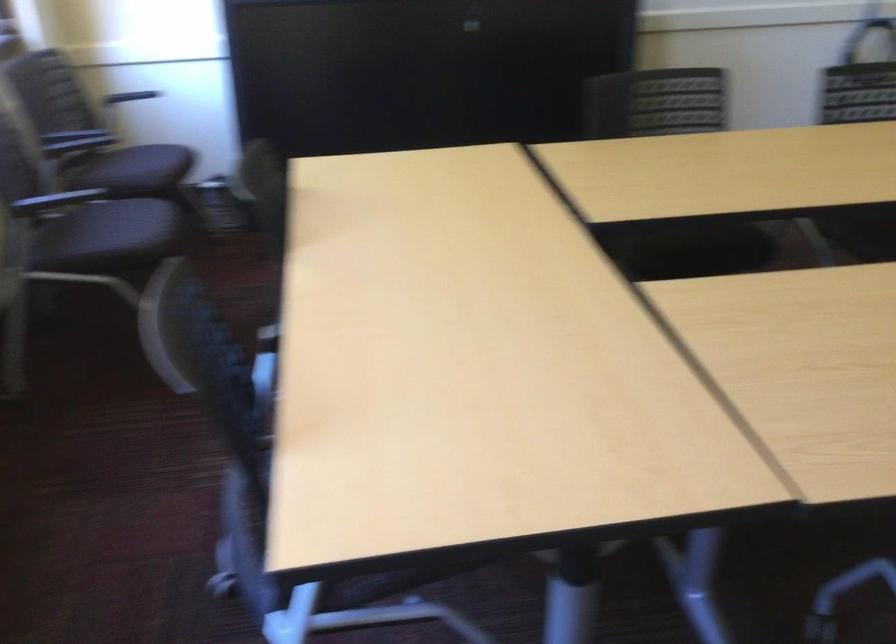
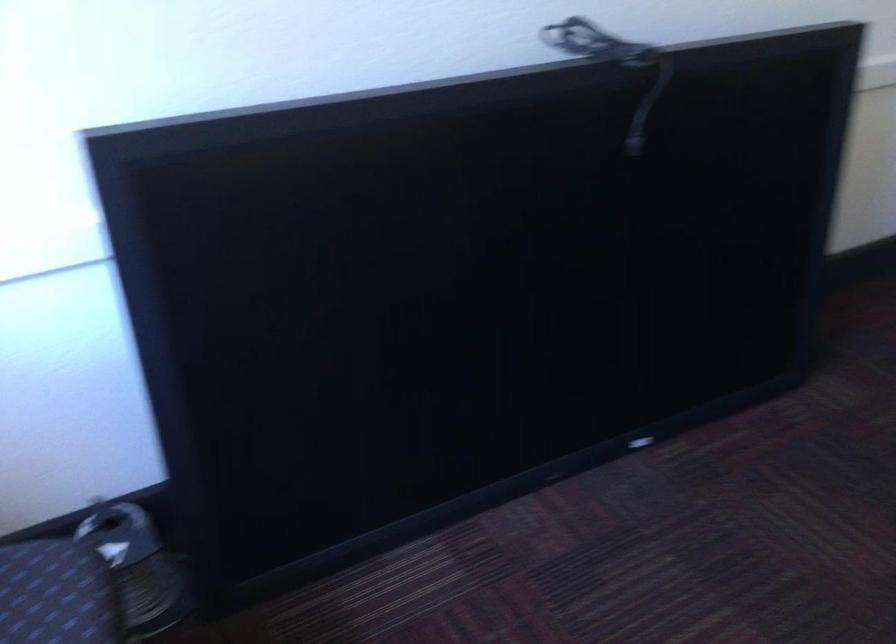
Which direction would the cameraman need to move to produce the second image?

The movement direction of the cameraman is left, forward.